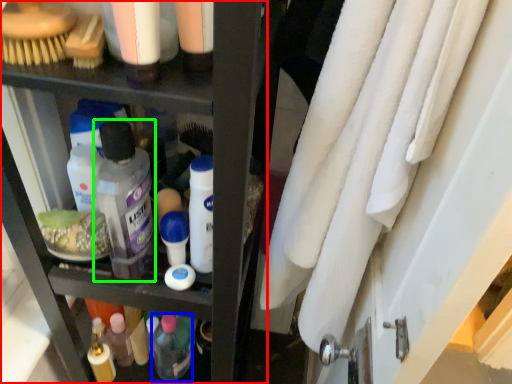
Question: Which object is the farthest from shelf (highlighted by a red box)? Choose among these: toiletry (highlighted by a blue box) or mouthwash (highlighted by a green box).

Choices:
 (A) toiletry
 (B) mouthwash

Answer: (A)